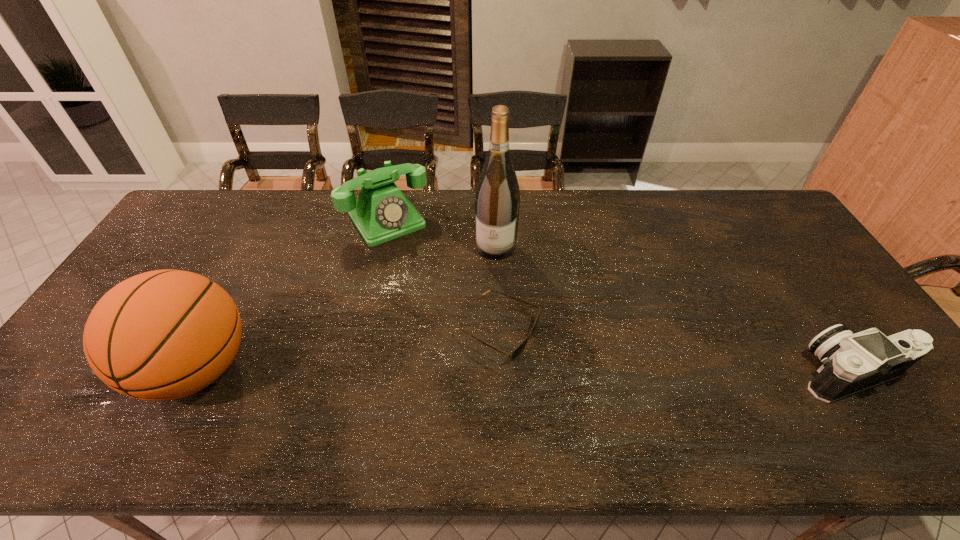
Find the location of a particular element. This screenshot has height=540, width=960. the leftmost object is located at coordinates click(x=166, y=334).

Identify the location of the fourth shortest object. The width and height of the screenshot is (960, 540). (166, 334).

Where is `the second shortest object`? the second shortest object is located at coordinates (851, 362).

This screenshot has width=960, height=540. Identify the location of camera. (851, 362).

Locate an element on the screen. the tallest object is located at coordinates (497, 201).

Where is `the second object from left to right`? The image size is (960, 540). the second object from left to right is located at coordinates (381, 212).

Find the location of a particular element. The width and height of the screenshot is (960, 540). telephone is located at coordinates (381, 212).

The image size is (960, 540). In order to click on the shortest object in this screenshot , I will do `click(519, 349)`.

This screenshot has height=540, width=960. I want to click on vacant position located on the back of the second tallest object, so click(x=258, y=251).

At what (x,y) coordinates should I click in order to perform the action: click on free region located on the back of the fourth tallest object. Please return your answer as a coordinate pair (x, y). The image size is (960, 540). Looking at the image, I should click on (793, 288).